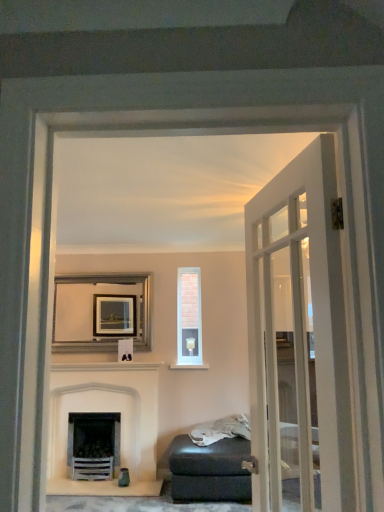
The height and width of the screenshot is (512, 384). I want to click on free spot above silver metallic picture frame at center (from a real-world perspective), so click(x=108, y=274).